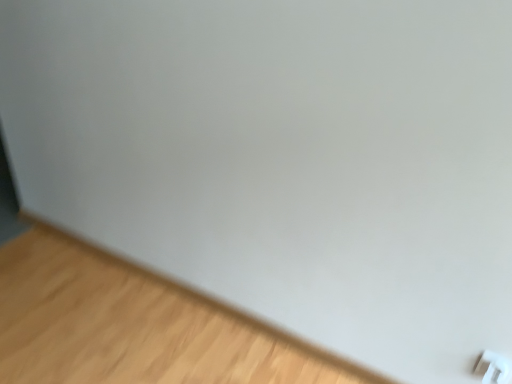
The image size is (512, 384). Find the location of `white plastic power plugs and sockets at lower right`. white plastic power plugs and sockets at lower right is located at coordinates (493, 368).

Describe the element at coordinates (493, 368) in the screenshot. I see `white plastic power plugs and sockets at lower right` at that location.

You are a GUI agent. You are given a task and a screenshot of the screen. Output one action in this format:
    pyautogui.click(x=<x>, y=<y>)
    Task: Click on the white plastic power plugs and sockets at lower right
    
    Given the screenshot: What is the action you would take?
    pyautogui.click(x=493, y=368)